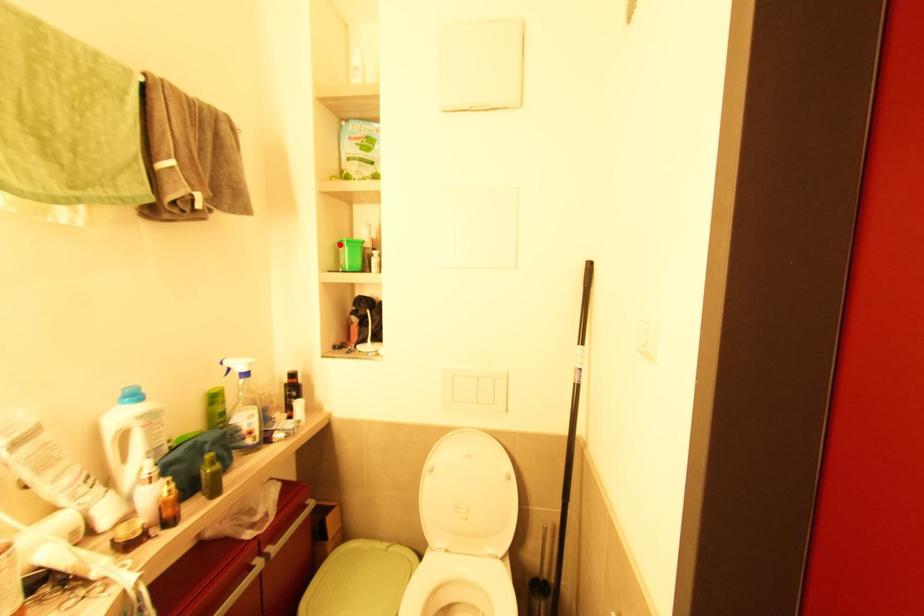
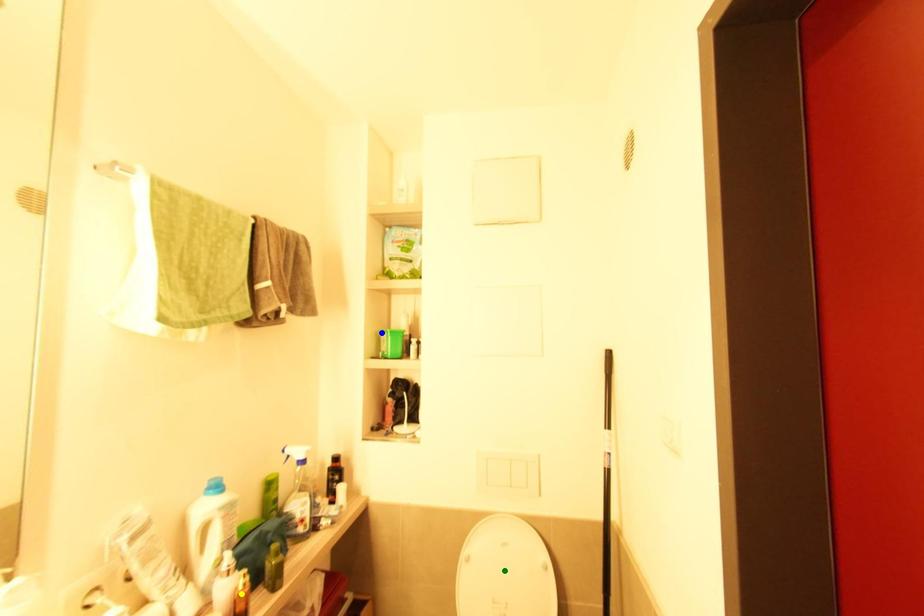
Question: I am providing you with two images of the same scene from different viewpoints. A red point is marked on the first image. You are given multiple points on the second image. Which point in image 2 is actually the same real-world point as the red point in image 1?

Choices:
 (A) yellow point
 (B) blue point
 (C) green point

Answer: (B)